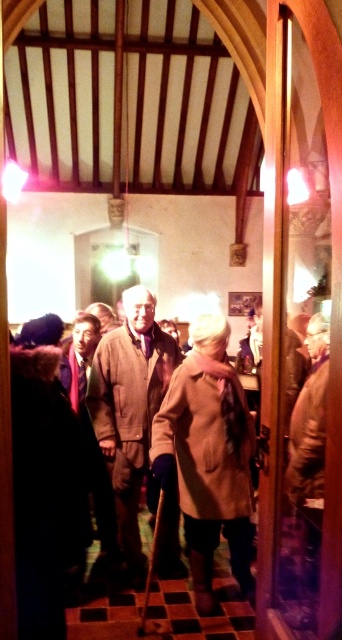
Can you confirm if beige woolen trench coat at center is positioned to the right of beige wool coat at center?

Indeed, beige woolen trench coat at center is positioned on the right side of beige wool coat at center.

Between beige woolen trench coat at center and beige wool coat at center, which one is positioned lower?

beige woolen trench coat at center is lower down.

Which is in front, point (200, 608) or point (133, 556)?

Point (200, 608) is more forward.

At what (x,y) coordinates should I click in order to perform the action: click on beige woolen trench coat at center. Please return your answer as a coordinate pair (x, y). This screenshot has height=640, width=342. Looking at the image, I should click on [208, 456].